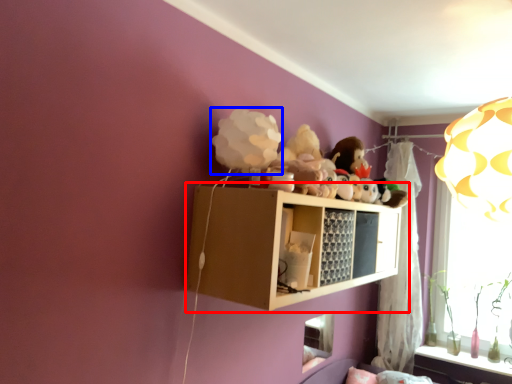
Question: Which of the following is the closest to the observer, shelf (highlighted by a red box) or toy (highlighted by a blue box)?

Choices:
 (A) shelf
 (B) toy

Answer: (A)